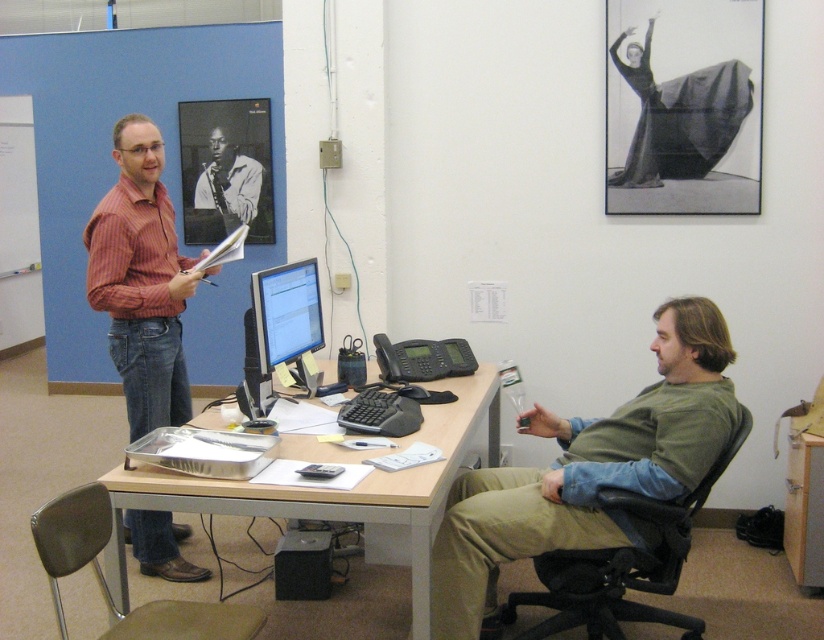
Question: Is matte black monitor at center closer to the viewer compared to black and white photograph of man playing saxophone at upper left?

Choices:
 (A) yes
 (B) no

Answer: (A)

Question: Can you confirm if black plastic chair at right is wider than black and white photograph of man playing saxophone at upper left?

Choices:
 (A) no
 (B) yes

Answer: (B)

Question: Which point is farther to the camera?

Choices:
 (A) black plastic chair at right
 (B) matte black monitor at center
 (C) black and white photograph of man playing saxophone at upper left

Answer: (C)

Question: Which of the following is the closest to the observer?

Choices:
 (A) (143, 340)
 (B) (293, 323)
 (C) (256, 177)
 (D) (634, 609)

Answer: (D)

Question: Which point appears closest to the camera in this image?

Choices:
 (A) 199,280
 (B) 59,554
 (C) 569,620
 (D) 419,541

Answer: (B)

Question: Does reddish-brown striped shirt at left have a larger size compared to matte black monitor at center?

Choices:
 (A) no
 (B) yes

Answer: (B)